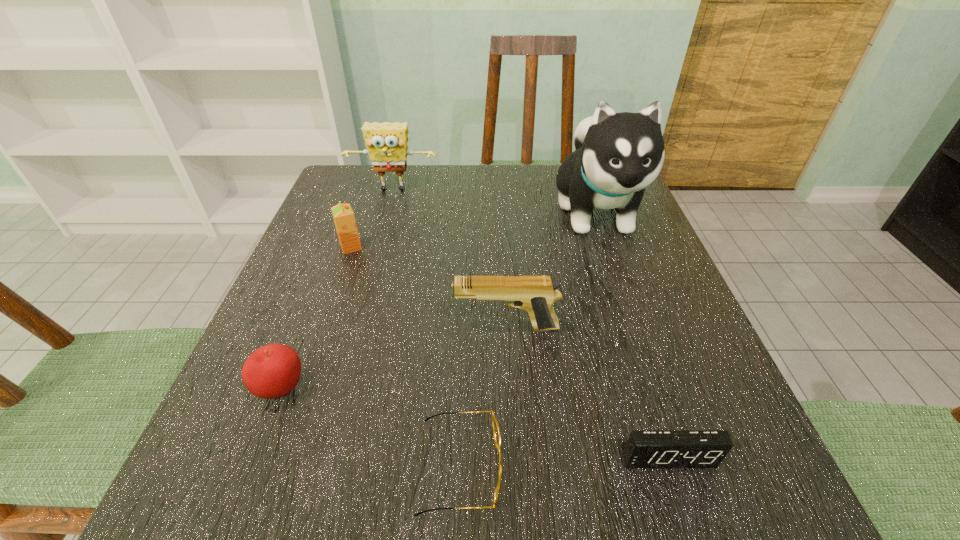
In order to click on spectacles that is at the near edge in this screenshot , I will do `click(496, 430)`.

I want to click on sponge that is at the left edge, so click(386, 142).

Find the location of a particular element. The image size is (960, 540). orange juice that is at the left edge is located at coordinates (344, 219).

You are a GUI agent. You are given a task and a screenshot of the screen. Output one action in this format:
    pyautogui.click(x=<x>, y=<y>)
    Task: Click on the apple that is at the left edge
    
    Given the screenshot: What is the action you would take?
    pyautogui.click(x=272, y=371)

The height and width of the screenshot is (540, 960). In order to click on puppy located in the right edge section of the desktop in this screenshot , I will do `click(617, 155)`.

I want to click on alarm clock that is positioned at the right edge, so click(x=645, y=448).

At what (x,y) coordinates should I click in order to perform the action: click on object present at the far left corner. Please return your answer as a coordinate pair (x, y). Image resolution: width=960 pixels, height=540 pixels. Looking at the image, I should click on (386, 142).

At what (x,y) coordinates should I click in order to perform the action: click on object present at the far right corner. Please return your answer as a coordinate pair (x, y). This screenshot has width=960, height=540. Looking at the image, I should click on pos(617,155).

Identify the location of object at the near right corner. Image resolution: width=960 pixels, height=540 pixels. (645, 448).

I want to click on free region at the far edge, so click(x=444, y=183).